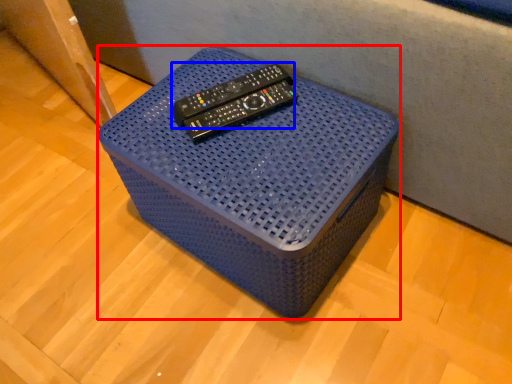
Question: Which point is further to the camera, furniture (highlighted by a red box) or remote (highlighted by a blue box)?

Choices:
 (A) furniture
 (B) remote

Answer: (B)